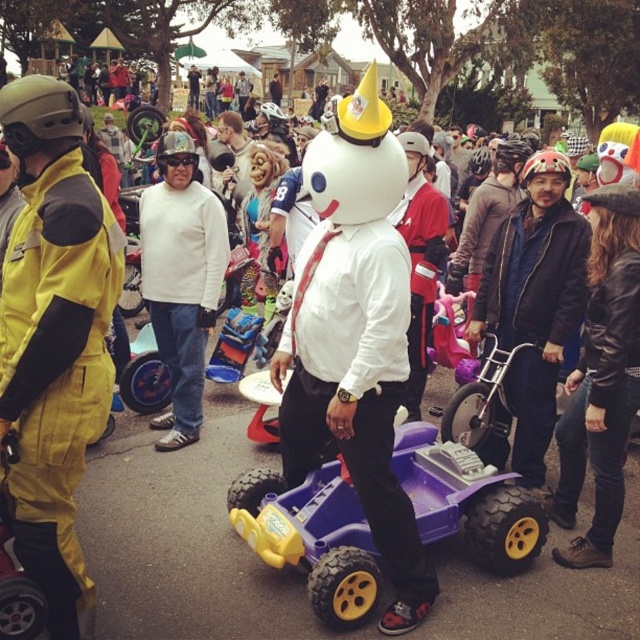
Question: Which point is closer to the camera?

Choices:
 (A) yellow matte jumpsuit at left
 (B) purple plastic toy car at center
 (C) matte purple plastic toy car at center

Answer: (A)

Question: Is yellow matte jumpsuit at left to the left of purple plastic toy car at center from the viewer's perspective?

Choices:
 (A) no
 (B) yes

Answer: (B)

Question: Observing the image, what is the correct spatial positioning of yellow matte jumpsuit at left in reference to purple plastic toy car at center?

Choices:
 (A) above
 (B) below

Answer: (A)

Question: Which point is farther to the camera?

Choices:
 (A) purple plastic toy car at center
 (B) yellow matte jumpsuit at left

Answer: (A)

Question: Where is matte purple plastic toy car at center located in relation to purple plastic toy car at center in the image?

Choices:
 (A) above
 (B) below

Answer: (B)

Question: Which point appears closest to the camera in this image?

Choices:
 (A) (326, 236)
 (B) (352, 508)

Answer: (A)